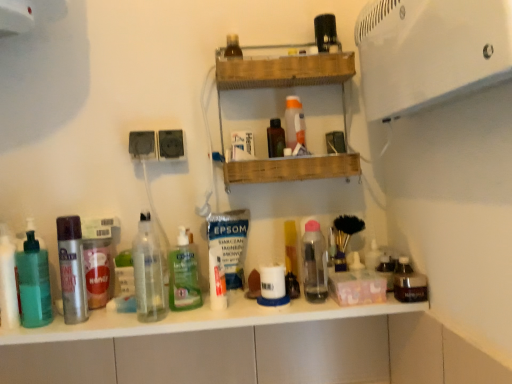
At what (x,y) coordinates should I click in order to perform the action: click on white plastic jar at center, arranged as the first toiletry when ordered from the bottom. Please return your answer as a coordinate pair (x, y). The height and width of the screenshot is (384, 512). Looking at the image, I should click on (273, 286).

The width and height of the screenshot is (512, 384). Describe the element at coordinates (217, 279) in the screenshot. I see `white matte tube at center, the 2th toiletry when ordered from left to right` at that location.

Describe the element at coordinates (202, 319) in the screenshot. I see `white glossy counter top at center` at that location.

The width and height of the screenshot is (512, 384). What do you see at coordinates (233, 47) in the screenshot?
I see `transparent plastic bottle at upper center, which is the third toiletry from left to right` at bounding box center [233, 47].

The width and height of the screenshot is (512, 384). Describe the element at coordinates (72, 269) in the screenshot. I see `silver metallic spray can at left, marked as the fourth bottle in a right-to-left arrangement` at that location.

The width and height of the screenshot is (512, 384). I want to click on white plastic jar at center, the 1th toiletry positioned from the right, so click(x=273, y=286).

From the image's perspective, starting from the transparent plastic bottle at upper center, placed as the 2th toiletry when sorted from right to left, which bottle is the 3rd one below? Please provide its 2D coordinates.

[(184, 274)]

Would you say green translucent bottle at center, the fourth bottle when ordered from left to right, is inside or outside transparent plastic bottle at upper center, which ranks as the 1th toiletry in top-to-bottom order?

green translucent bottle at center, the fourth bottle when ordered from left to right, lies outside transparent plastic bottle at upper center, which ranks as the 1th toiletry in top-to-bottom order.

Considering the relative sizes of green translucent bottle at center, which is counted as the second bottle, starting from the right, and transparent plastic bottle at upper center, which ranks as the 1th toiletry in top-to-bottom order, in the image provided, is green translucent bottle at center, which is counted as the second bottle, starting from the right, taller than transparent plastic bottle at upper center, which ranks as the 1th toiletry in top-to-bottom order,?

Yes, green translucent bottle at center, which is counted as the second bottle, starting from the right, is taller than transparent plastic bottle at upper center, which ranks as the 1th toiletry in top-to-bottom order.

Is green translucent bottle at center, the fourth bottle when ordered from left to right, not near transparent plastic bottle at upper center, placed as the 2th toiletry when sorted from right to left?

No.

How distant is silver metallic spray can at left, placed as the second bottle when sorted from left to right, from white glossy counter top at center?

silver metallic spray can at left, placed as the second bottle when sorted from left to right, and white glossy counter top at center are 8.62 inches apart from each other.

From the image's perspective, relative to white glossy counter top at center, is silver metallic spray can at left, marked as the fourth bottle in a right-to-left arrangement, above or below?

From the image's perspective, silver metallic spray can at left, marked as the fourth bottle in a right-to-left arrangement, appears above white glossy counter top at center.

Is silver metallic spray can at left, marked as the fourth bottle in a right-to-left arrangement, in contact with white glossy counter top at center?

No, silver metallic spray can at left, marked as the fourth bottle in a right-to-left arrangement, is not making contact with white glossy counter top at center.

Is silver metallic spray can at left, marked as the fourth bottle in a right-to-left arrangement, wider or thinner than white glossy counter top at center?

Considering their sizes, silver metallic spray can at left, marked as the fourth bottle in a right-to-left arrangement, looks slimmer than white glossy counter top at center.

Could you tell me if silver metallic spray can at left, marked as the fourth bottle in a right-to-left arrangement, is facing wooden shelf at upper center?

No, silver metallic spray can at left, marked as the fourth bottle in a right-to-left arrangement, is not oriented towards wooden shelf at upper center.

From a real-world perspective, is silver metallic spray can at left, placed as the second bottle when sorted from left to right, physically below wooden shelf at upper center?

Yes, from a real-world perspective, silver metallic spray can at left, placed as the second bottle when sorted from left to right, is beneath wooden shelf at upper center.

Where is `shelf above the silver metallic spray can at left, marked as the fourth bottle in a right-to-left arrangement (from a real-world perspective)`? shelf above the silver metallic spray can at left, marked as the fourth bottle in a right-to-left arrangement (from a real-world perspective) is located at coordinates (284, 75).

Does silver metallic spray can at left, marked as the fourth bottle in a right-to-left arrangement, have a larger size compared to wooden shelf at upper center?

No.

Does white glossy counter top at center turn towards white matte tube at center, the second toiletry ordered from the bottom?

No, white glossy counter top at center is not oriented towards white matte tube at center, the second toiletry ordered from the bottom.

Which toiletry is the 3rd one when counting from the back of the white glossy counter top at center? Please provide its 2D coordinates.

[(217, 279)]

Is white glossy counter top at center positioned beyond the bounds of white matte tube at center, the second toiletry ordered from the bottom?

Yes, white glossy counter top at center is outside of white matte tube at center, the second toiletry ordered from the bottom.

Is white glossy counter top at center to the right of white matte tube at center, which is counted as the 3th toiletry, starting from the top, from the viewer's perspective?

Incorrect, white glossy counter top at center is not on the right side of white matte tube at center, which is counted as the 3th toiletry, starting from the top.

Is silver metallic spray can at left, placed as the second bottle when sorted from left to right, facing away from transparent plastic bottle at center, the 5th bottle viewed from the left?

That's not correct — silver metallic spray can at left, placed as the second bottle when sorted from left to right, is not looking away from transparent plastic bottle at center, the 5th bottle viewed from the left.

Is silver metallic spray can at left, marked as the fourth bottle in a right-to-left arrangement, inside the boundaries of transparent plastic bottle at center, the 5th bottle viewed from the left, or outside?

silver metallic spray can at left, marked as the fourth bottle in a right-to-left arrangement, is located beyond the bounds of transparent plastic bottle at center, the 5th bottle viewed from the left.

Looking at this image, from the image's perspective, which one is positioned higher, silver metallic spray can at left, placed as the second bottle when sorted from left to right, or transparent plastic bottle at center, which is the first bottle from right to left?

From the image's view, transparent plastic bottle at center, which is the first bottle from right to left, is above.

Image resolution: width=512 pixels, height=384 pixels. What are the coordinates of `the 2nd toiletry below the translucent plastic soap dispenser at left, the 5th bottle viewed from the right (from the image's perspective)` in the screenshot? It's located at (217, 279).

Does point (17, 268) come behind point (224, 307)?

No, it is in front of (224, 307).

From a real-world perspective, which object stands above the other?

In real-world perspective, translucent plastic soap dispenser at left, marked as the first bottle in a left-to-right arrangement, is above.

Looking at this image, can you confirm if translucent plastic soap dispenser at left, the 5th bottle viewed from the right, is bigger than white matte tube at center, the second toiletry ordered from the bottom?

Yes.

Is there a large distance between translucent plastic soap dispenser at left, the 5th bottle viewed from the right, and silver metallic spray can at left, placed as the second bottle when sorted from left to right?

No, there isn't a large distance between translucent plastic soap dispenser at left, the 5th bottle viewed from the right, and silver metallic spray can at left, placed as the second bottle when sorted from left to right.

Which of these two, translucent plastic soap dispenser at left, the 5th bottle viewed from the right, or silver metallic spray can at left, marked as the fourth bottle in a right-to-left arrangement, stands shorter?

silver metallic spray can at left, marked as the fourth bottle in a right-to-left arrangement, is shorter.

What's the angular difference between translucent plastic soap dispenser at left, the 5th bottle viewed from the right, and silver metallic spray can at left, placed as the second bottle when sorted from left to right,'s facing directions?

0.00215 degrees.

Between translucent plastic soap dispenser at left, the 5th bottle viewed from the right, and silver metallic spray can at left, placed as the second bottle when sorted from left to right, which one has smaller size?

silver metallic spray can at left, placed as the second bottle when sorted from left to right, is smaller.

From a real-world perspective, count 2nd toiletrys upward from the green translucent bottle at center, which is counted as the second bottle, starting from the right, and point to it. Please provide its 2D coordinates.

[(233, 47)]

Locate an element on the screen. The image size is (512, 384). counter top in front of the silver metallic spray can at left, placed as the second bottle when sorted from left to right is located at coordinates (202, 319).

Looking at the image, which one is located closer to green translucent bottle at center, which is counted as the second bottle, starting from the right, silver metallic spray can at left, placed as the second bottle when sorted from left to right, or white plastic jar at center, the fourth toiletry in the top-to-bottom sequence?

The object closer to green translucent bottle at center, which is counted as the second bottle, starting from the right, is white plastic jar at center, the fourth toiletry in the top-to-bottom sequence.

Considering their positions, is white glossy counter top at center positioned closer to white plastic jar at center, arranged as the first toiletry when ordered from the bottom, than transparent plastic bottle at upper center, which is the third toiletry from left to right?

Based on the image, white glossy counter top at center appears to be nearer to white plastic jar at center, arranged as the first toiletry when ordered from the bottom.

Estimate the real-world distances between objects in this image. Which object is closer to transparent plastic bottle at upper center, placed as the 2th toiletry when sorted from right to left, clear glass bottle at center, the third bottle viewed from the right, or translucent green pump bottle at left, which appears as the second toiletry when viewed from the top?

Based on the image, clear glass bottle at center, the third bottle viewed from the right, appears to be nearer to transparent plastic bottle at upper center, placed as the 2th toiletry when sorted from right to left.

Estimate the real-world distances between objects in this image. Which object is further from translucent green pump bottle at left, which appears as the third toiletry when ordered from the bottom, translucent plastic soap dispenser at left, marked as the first bottle in a left-to-right arrangement, or transparent plastic bottle at upper center, which is the third toiletry from left to right?

Based on the image, transparent plastic bottle at upper center, which is the third toiletry from left to right, appears to be further to translucent green pump bottle at left, which appears as the third toiletry when ordered from the bottom.

Which object lies further to the anchor point clear glass bottle at center, the 3th bottle from the left, green translucent bottle at center, the fourth bottle when ordered from left to right, or silver metallic spray can at left, placed as the second bottle when sorted from left to right?

silver metallic spray can at left, placed as the second bottle when sorted from left to right, is further to clear glass bottle at center, the 3th bottle from the left.

Based on their spatial positions, is wooden shelf at upper center or translucent plastic soap dispenser at left, the 5th bottle viewed from the right, further from white glossy counter top at center?

Based on the image, wooden shelf at upper center appears to be further to white glossy counter top at center.

Looking at the image, which one is located further to white glossy counter top at center, silver metallic spray can at left, marked as the fourth bottle in a right-to-left arrangement, or white matte tube at center, the second toiletry ordered from the bottom?

silver metallic spray can at left, marked as the fourth bottle in a right-to-left arrangement, is positioned further to the anchor white glossy counter top at center.

Based on their spatial positions, is white matte tube at center, the second toiletry ordered from the bottom, or wooden shelf at upper center further from translucent plastic soap dispenser at left, the 5th bottle viewed from the right?

wooden shelf at upper center is further to translucent plastic soap dispenser at left, the 5th bottle viewed from the right.

Locate an element on the screen. The width and height of the screenshot is (512, 384). counter top situated between translucent green pump bottle at left, which appears as the second toiletry when viewed from the top, and wooden shelf at upper center from left to right is located at coordinates point(202,319).

Locate an element on the screen. Image resolution: width=512 pixels, height=384 pixels. shelf between transparent plastic bottle at upper center, which is the third toiletry from left to right, and white plastic jar at center, arranged as the first toiletry when ordered from the bottom, in the vertical direction is located at coordinates (284, 75).

Identify the location of counter top between translucent plastic soap dispenser at left, marked as the first bottle in a left-to-right arrangement, and white plastic jar at center, the fourth toiletry in the top-to-bottom sequence, in the horizontal direction. (202, 319).

The image size is (512, 384). I want to click on bottle between translucent plastic soap dispenser at left, marked as the first bottle in a left-to-right arrangement, and clear glass bottle at center, the third bottle viewed from the right, in the horizontal direction, so click(x=72, y=269).